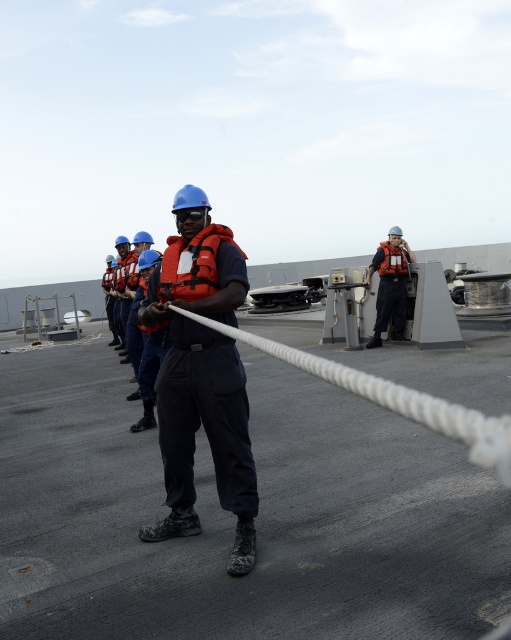
Does orange life vest at center come behind orange matte safety vest at center?

That is False.

Who is more forward, [220,493] or [403,259]?

Point [220,493] is in front.

The width and height of the screenshot is (511, 640). What do you see at coordinates (201, 376) in the screenshot? I see `orange life vest at center` at bounding box center [201, 376].

Identify the location of orange life vest at center. The image size is (511, 640). (201, 376).

Consider the image. Does white rope at center appear on the left side of orange matte safety vest at center?

Indeed, white rope at center is positioned on the left side of orange matte safety vest at center.

Who is positioned more to the left, white rope at center or orange matte safety vest at center?

From the viewer's perspective, white rope at center appears more on the left side.

What do you see at coordinates (393, 397) in the screenshot? The image size is (511, 640). I see `white rope at center` at bounding box center [393, 397].

Identify the location of white rope at center. This screenshot has width=511, height=640. (393, 397).

From the picture: Does orange life vest at center have a lesser height compared to white rope at center?

No, orange life vest at center is not shorter than white rope at center.

Is orange life vest at center positioned in front of white rope at center?

No, it is behind white rope at center.

Identify the location of orange life vest at center. Image resolution: width=511 pixels, height=640 pixels. (201, 376).